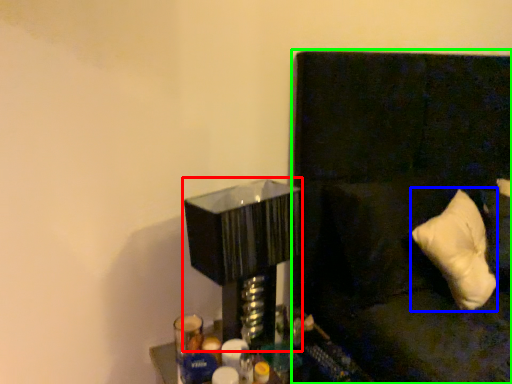
Question: Which object is the closest to the table lamp (highlighted by a red box)? Choose among these: pillow (highlighted by a blue box) or couch (highlighted by a green box).

Choices:
 (A) pillow
 (B) couch

Answer: (B)